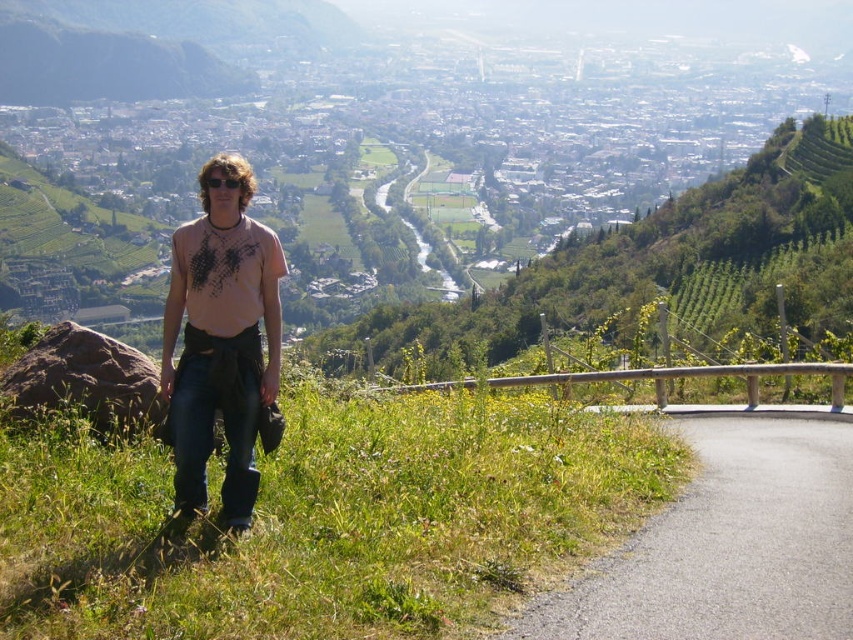
Question: Which of the following is the farthest from the observer?

Choices:
 (A) ripped denim jeans at lower left
 (B) green grassy at center
 (C) asphalt road at lower right

Answer: (A)

Question: Does green grassy at center appear under asphalt road at lower right?

Choices:
 (A) yes
 (B) no

Answer: (B)

Question: Estimate the real-world distances between objects in this image. Which object is closer to the asphalt road at lower right?

Choices:
 (A) ripped denim jeans at lower left
 (B) green grassy at center

Answer: (B)

Question: Can you confirm if asphalt road at lower right is wider than ripped denim jeans at lower left?

Choices:
 (A) yes
 (B) no

Answer: (A)

Question: Among these points, which one is nearest to the camera?

Choices:
 (A) (201, 296)
 (B) (625, 556)

Answer: (B)

Question: Can you confirm if green grassy at center is positioned to the left of asphalt road at lower right?

Choices:
 (A) no
 (B) yes

Answer: (B)